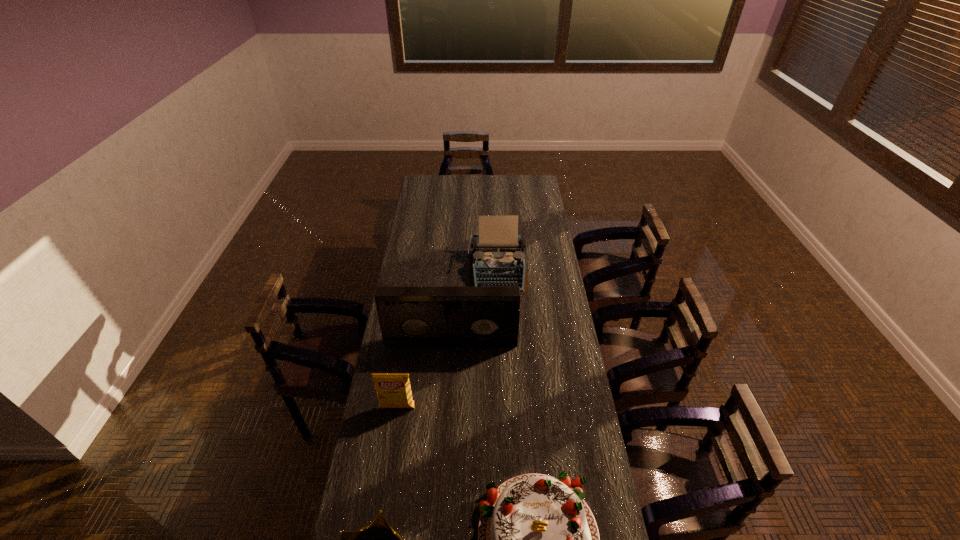
I want to click on blank area at the far edge, so tap(496, 177).

In the image, there is a desktop. Where is `free space at the left edge`? free space at the left edge is located at coordinates pyautogui.click(x=386, y=428).

This screenshot has height=540, width=960. What are the coordinates of `vacant space at the right edge of the desktop` in the screenshot? It's located at (551, 245).

The width and height of the screenshot is (960, 540). Identify the location of free point at the far right corner. (520, 178).

This screenshot has height=540, width=960. In order to click on vacant space that's between the third nearest object and the fourth nearest object in this screenshot , I will do `click(424, 375)`.

This screenshot has width=960, height=540. Identify the location of object that stands as the fourth closest to the crisp (potato chip). (498, 260).

What are the coordinates of `object identified as the fourth closest to the crown` in the screenshot? It's located at (498, 260).